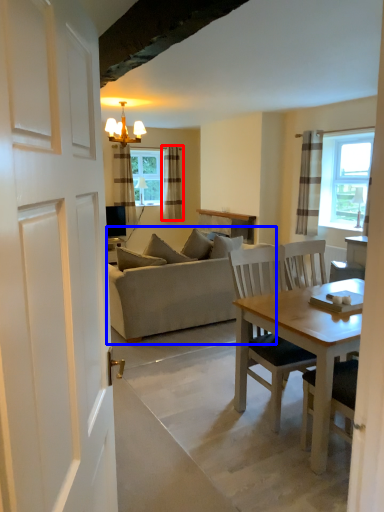
Question: Which point is further to the camera, curtain (highlighted by a red box) or studio couch (highlighted by a blue box)?

Choices:
 (A) curtain
 (B) studio couch

Answer: (A)